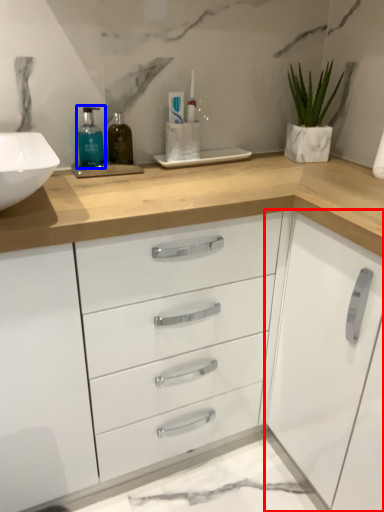
Question: Which object is further to the camera taking this photo, cabinetry (highlighted by a red box) or mouthwash (highlighted by a blue box)?

Choices:
 (A) cabinetry
 (B) mouthwash

Answer: (B)